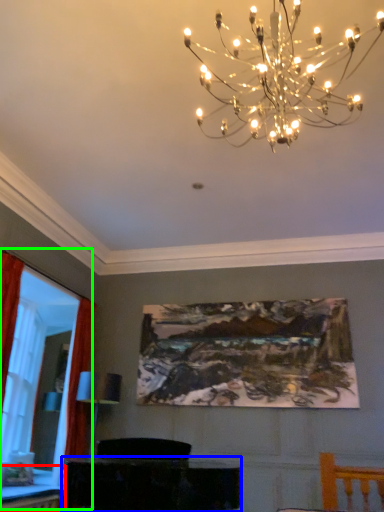
Question: Estimate the real-world distances between objects in this image. Which object is farther from table (highlighted by a red box), furniture (highlighted by a blue box) or bay window (highlighted by a green box)?

Choices:
 (A) furniture
 (B) bay window

Answer: (A)